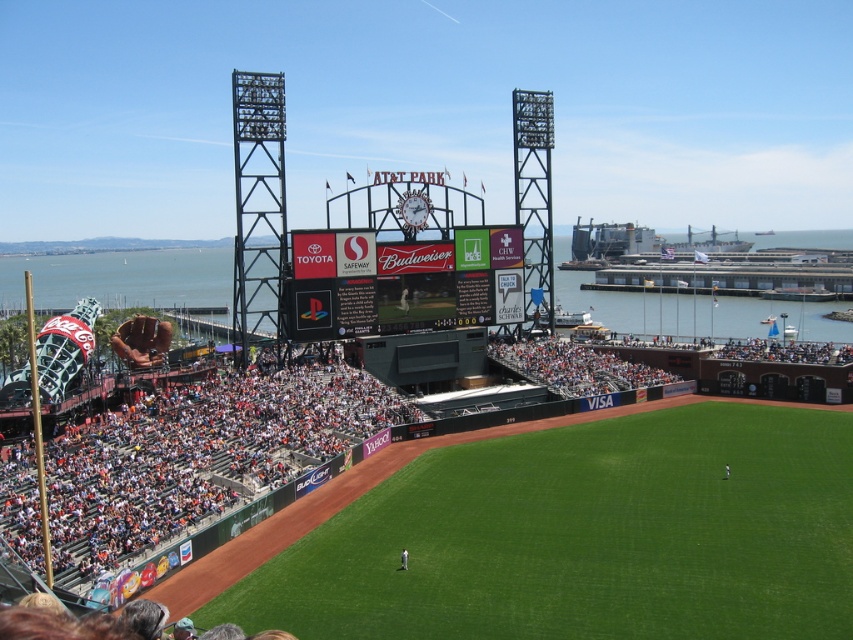
Who is taller, green grass at center or black matte scoreboard at center?

With more height is black matte scoreboard at center.

Which is more to the left, green grass at center or black matte scoreboard at center?

From the viewer's perspective, black matte scoreboard at center appears more on the left side.

Locate an element on the screen. The image size is (853, 640). green grass at center is located at coordinates (585, 536).